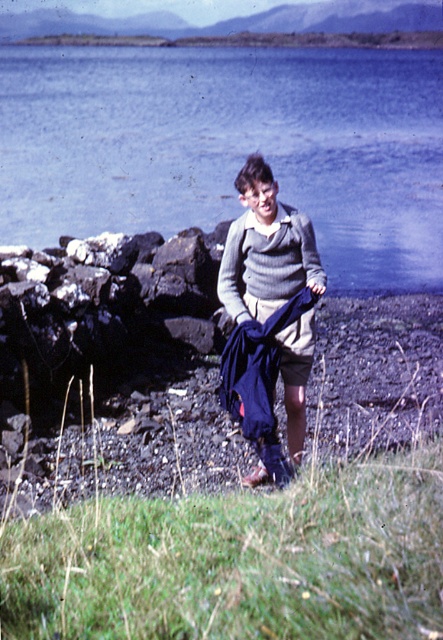
Question: Which of the following is the closest to the observer?

Choices:
 (A) blue water at center
 (B) knitted sweater at center
 (C) knitted gray sweater at center

Answer: (B)

Question: Is blue water at center below knitted gray sweater at center?

Choices:
 (A) no
 (B) yes

Answer: (A)

Question: Which point is closer to the camera?

Choices:
 (A) (194, 141)
 (B) (287, 205)

Answer: (B)

Question: Does blue water at center have a greater width compared to knitted sweater at center?

Choices:
 (A) yes
 (B) no

Answer: (A)

Question: Where is knitted sweater at center located in relation to knitted gray sweater at center in the image?

Choices:
 (A) left
 (B) right

Answer: (B)

Question: Among these objects, which one is farthest from the camera?

Choices:
 (A) knitted gray sweater at center
 (B) blue water at center

Answer: (B)